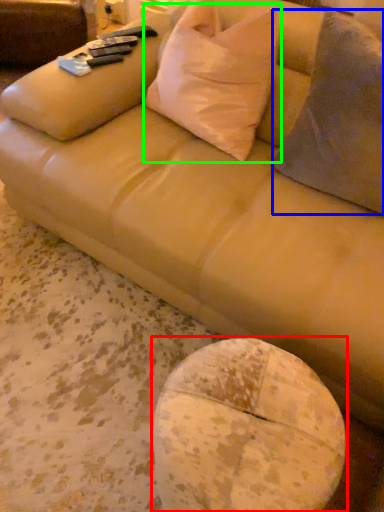
Question: Which object is positioned closest to round table (highlighted by a red box)? Select from throw pillow (highlighted by a blue box) and throw pillow (highlighted by a green box).

Choices:
 (A) throw pillow
 (B) throw pillow

Answer: (A)